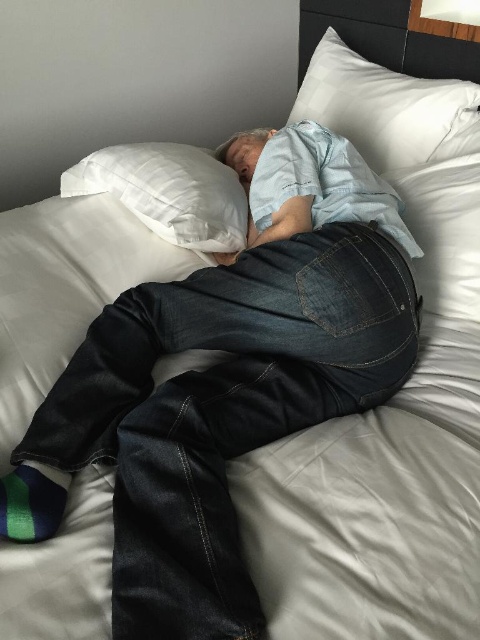
Which is behind, point (450, 109) or point (16, 531)?

Positioned behind is point (450, 109).

The width and height of the screenshot is (480, 640). I want to click on white soft pillow at upper right, so click(x=380, y=106).

Can you confirm if white soft pillow at upper right is positioned to the left of white soft pillow at upper left?

Incorrect, white soft pillow at upper right is not on the left side of white soft pillow at upper left.

In the scene shown: Can you confirm if white soft pillow at upper right is positioned below white soft pillow at upper left?

Incorrect, white soft pillow at upper right is not positioned below white soft pillow at upper left.

What do you see at coordinates (380, 106) in the screenshot? This screenshot has height=640, width=480. I see `white soft pillow at upper right` at bounding box center [380, 106].

Find the location of `white soft pillow at upper right`. white soft pillow at upper right is located at coordinates (380, 106).

Measure the distance between white soft pillow at upper left and camera.

white soft pillow at upper left is 1.09 meters from camera.

The width and height of the screenshot is (480, 640). What do you see at coordinates (168, 192) in the screenshot? I see `white soft pillow at upper left` at bounding box center [168, 192].

Locate an element on the screen. Image resolution: width=480 pixels, height=640 pixels. white soft pillow at upper left is located at coordinates (168, 192).

Where is `white soft pillow at upper left`? The height and width of the screenshot is (640, 480). white soft pillow at upper left is located at coordinates (168, 192).